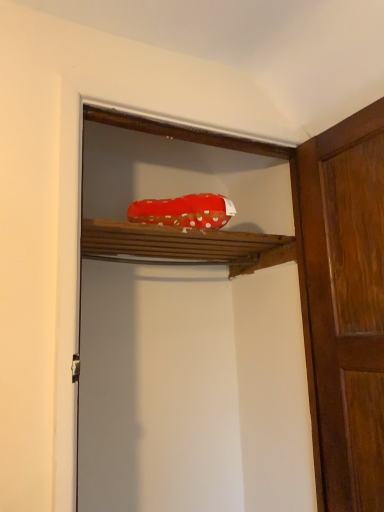
Question: Considering the relative sizes of wooden door at right and red fabric shoe at upper center in the image provided, is wooden door at right shorter than red fabric shoe at upper center?

Choices:
 (A) no
 (B) yes

Answer: (B)

Question: Is the depth of wooden door at right less than that of red fabric shoe at upper center?

Choices:
 (A) yes
 (B) no

Answer: (B)

Question: Is wooden door at right facing towards red fabric shoe at upper center?

Choices:
 (A) yes
 (B) no

Answer: (A)

Question: Does wooden door at right touch red fabric shoe at upper center?

Choices:
 (A) no
 (B) yes

Answer: (A)

Question: Is wooden door at right located outside red fabric shoe at upper center?

Choices:
 (A) no
 (B) yes

Answer: (B)

Question: Are wooden door at right and red fabric shoe at upper center far apart?

Choices:
 (A) no
 (B) yes

Answer: (A)

Question: Would you say red polka dot fabric at upper center is part of wooden door at right's contents?

Choices:
 (A) yes
 (B) no

Answer: (B)

Question: Would you say wooden door at right is a long distance from red polka dot fabric at upper center?

Choices:
 (A) no
 (B) yes

Answer: (A)

Question: Does wooden door at right come in front of red polka dot fabric at upper center?

Choices:
 (A) yes
 (B) no

Answer: (A)

Question: Does wooden door at right have a smaller size compared to red polka dot fabric at upper center?

Choices:
 (A) no
 (B) yes

Answer: (A)

Question: Does wooden door at right lie behind red polka dot fabric at upper center?

Choices:
 (A) no
 (B) yes

Answer: (A)

Question: Considering the relative positions of wooden door at right and red polka dot fabric at upper center in the image provided, is wooden door at right to the left of red polka dot fabric at upper center from the viewer's perspective?

Choices:
 (A) no
 (B) yes

Answer: (A)

Question: Is the position of red polka dot fabric at upper center more distant than that of red fabric shoe at upper center?

Choices:
 (A) yes
 (B) no

Answer: (A)